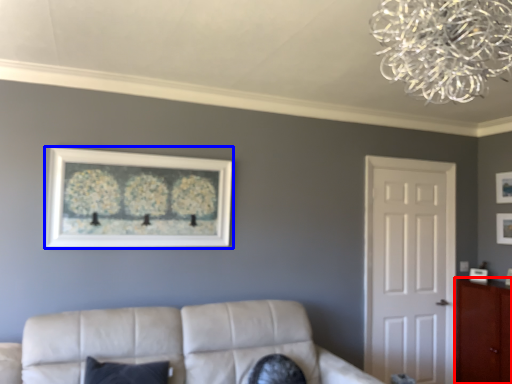
Question: Which of the following is the closest to the observer, cabinetry (highlighted by a red box) or picture frame (highlighted by a blue box)?

Choices:
 (A) cabinetry
 (B) picture frame

Answer: (B)